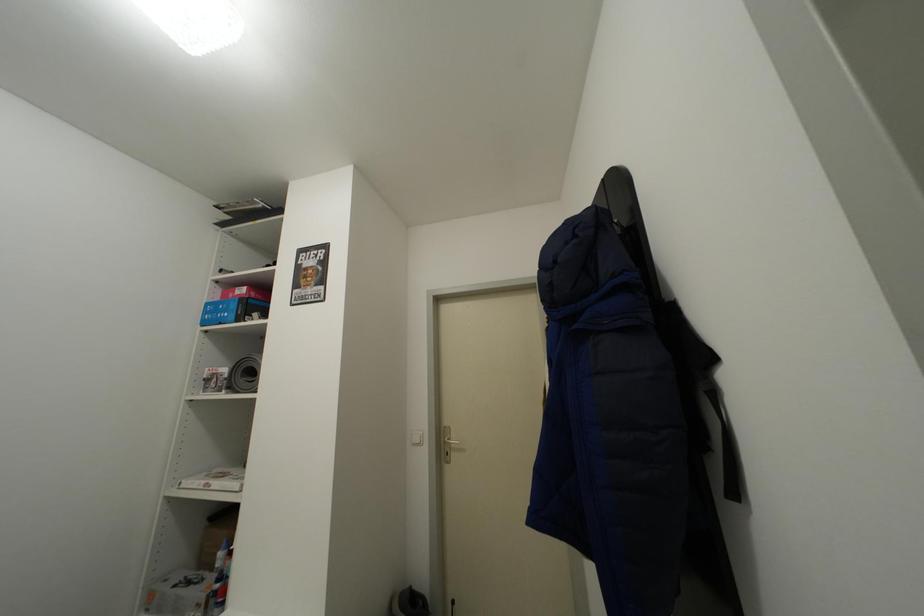
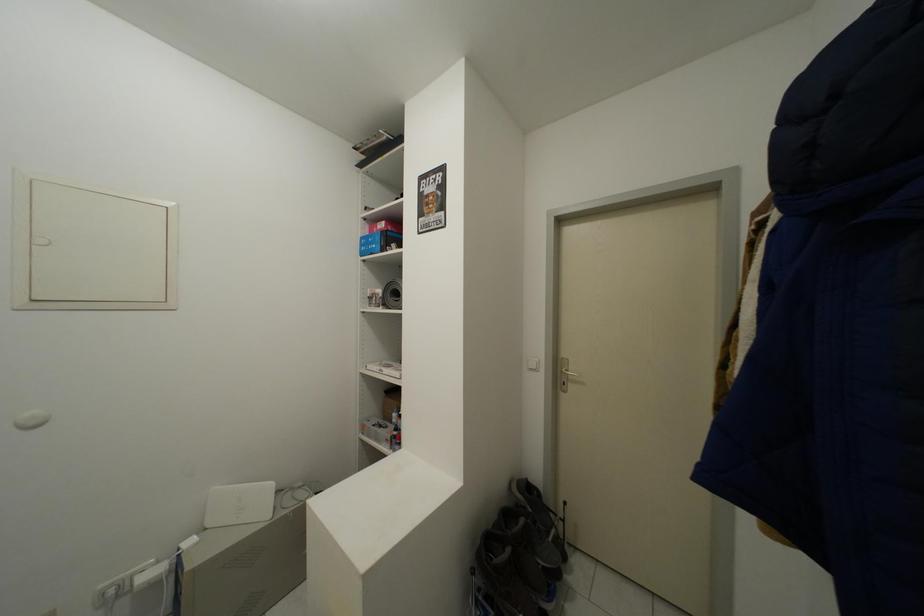
In a continuous first-person perspective shot, in which direction is the camera moving?

The cameraman walked toward left, forward.